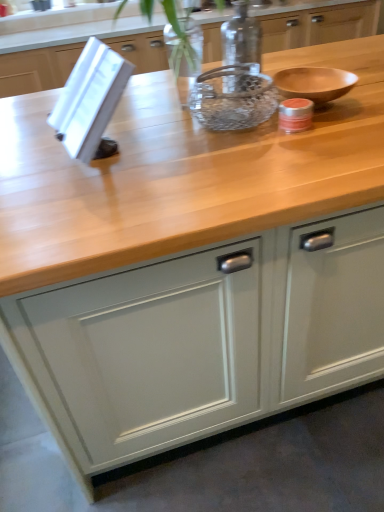
Question: From a real-world perspective, is matte gray cabinet at center below clear glass jar at center?

Choices:
 (A) yes
 (B) no

Answer: (A)

Question: Does matte gray cabinet at center appear on the right side of clear glass jar at center?

Choices:
 (A) no
 (B) yes

Answer: (B)

Question: Does matte gray cabinet at center have a greater height compared to clear glass jar at center?

Choices:
 (A) no
 (B) yes

Answer: (B)

Question: Could you tell me if matte gray cabinet at center is facing clear glass jar at center?

Choices:
 (A) yes
 (B) no

Answer: (B)

Question: Is matte gray cabinet at center far from clear glass jar at center?

Choices:
 (A) yes
 (B) no

Answer: (B)

Question: Is matte gray cabinet at center to the left of clear glass jar at center from the viewer's perspective?

Choices:
 (A) no
 (B) yes

Answer: (A)

Question: Considering the relative sizes of matte gray cabinet at center and clear glass bowl at center in the image provided, is matte gray cabinet at center shorter than clear glass bowl at center?

Choices:
 (A) no
 (B) yes

Answer: (A)

Question: Is matte gray cabinet at center far from clear glass bowl at center?

Choices:
 (A) no
 (B) yes

Answer: (A)

Question: Does matte gray cabinet at center have a greater width compared to clear glass bowl at center?

Choices:
 (A) yes
 (B) no

Answer: (A)

Question: From the image's perspective, is matte gray cabinet at center beneath clear glass bowl at center?

Choices:
 (A) yes
 (B) no

Answer: (A)

Question: Considering the relative positions of matte gray cabinet at center and clear glass bowl at center in the image provided, is matte gray cabinet at center to the left of clear glass bowl at center from the viewer's perspective?

Choices:
 (A) yes
 (B) no

Answer: (B)

Question: Can you confirm if matte gray cabinet at center is bigger than clear glass bowl at center?

Choices:
 (A) yes
 (B) no

Answer: (A)

Question: Is clear glass jar at center wider than matte gray cabinet at center?

Choices:
 (A) yes
 (B) no

Answer: (B)